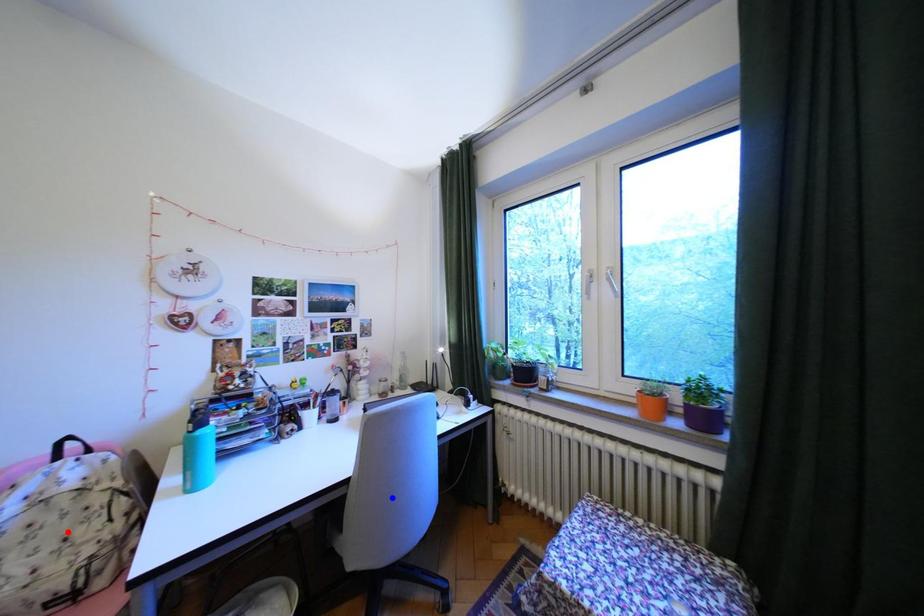
Question: Which of the two points in the image is closer to the camera?

Choices:
 (A) Blue point is closer.
 (B) Red point is closer.

Answer: (B)